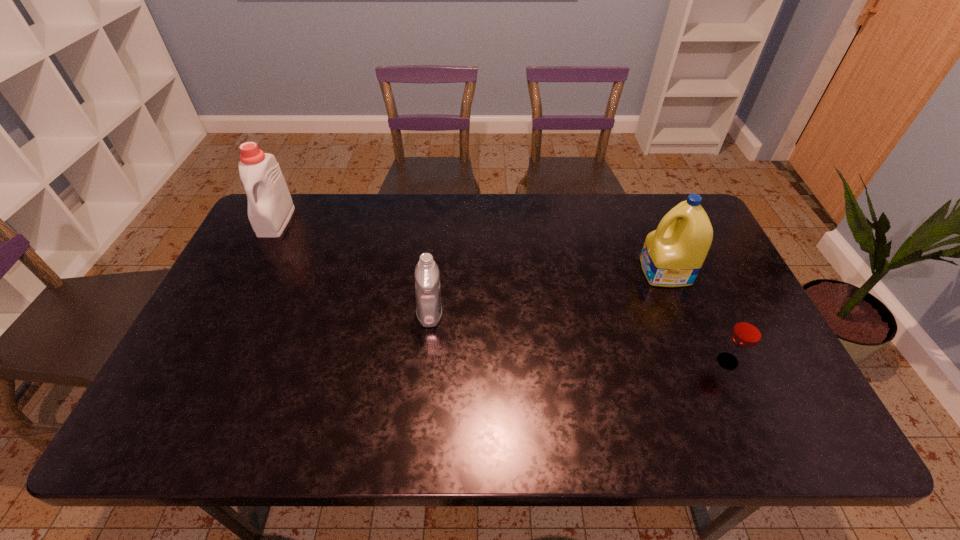
Where is `free space at the near edge of the desktop`? The image size is (960, 540). free space at the near edge of the desktop is located at coordinates (516, 442).

The image size is (960, 540). I want to click on vacant space at the left edge of the desktop, so click(x=265, y=289).

You are a GUI agent. You are given a task and a screenshot of the screen. Output one action in this format:
    pyautogui.click(x=<x>, y=<y>)
    Task: Click on the free region at the right edge of the desktop
    
    Given the screenshot: What is the action you would take?
    pyautogui.click(x=766, y=346)

Identify the location of blank area at the near left corner. (180, 421).

Where is `unoccupied area between the glass and the leftmost object`? unoccupied area between the glass and the leftmost object is located at coordinates (502, 291).

The height and width of the screenshot is (540, 960). Identify the location of free spot between the leftmost detergent and the second farthest detergent. (470, 246).

Locate an element on the screen. free spot between the second detergent from left to right and the rightmost detergent is located at coordinates (547, 293).

Locate an element on the screen. This screenshot has height=540, width=960. free space that is in between the second detergent from right to left and the rightmost detergent is located at coordinates (547, 293).

Locate an element on the screen. The width and height of the screenshot is (960, 540). free space between the leftmost detergent and the third nearest object is located at coordinates (470, 246).

Locate an element on the screen. The height and width of the screenshot is (540, 960). vacant area that lies between the third farthest object and the nearest object is located at coordinates (579, 338).